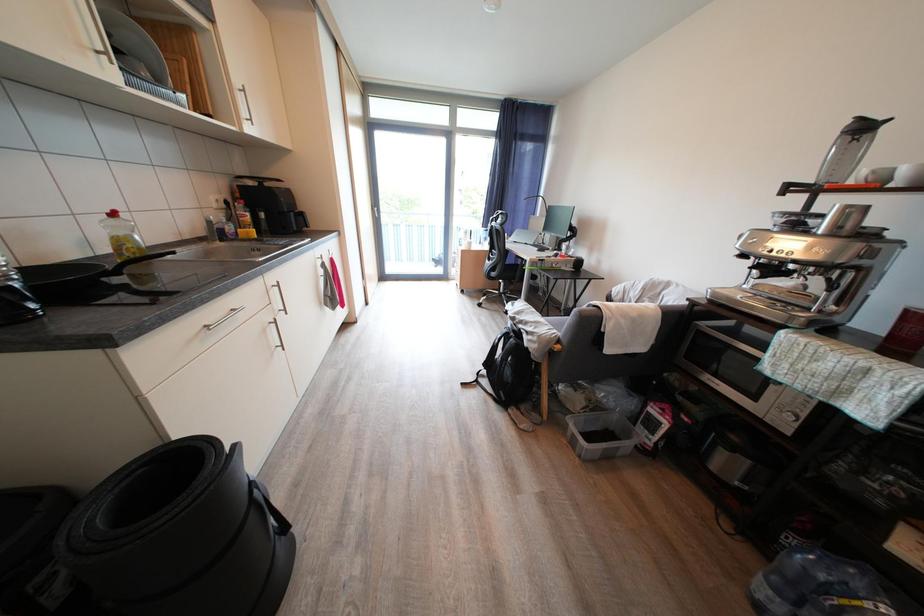
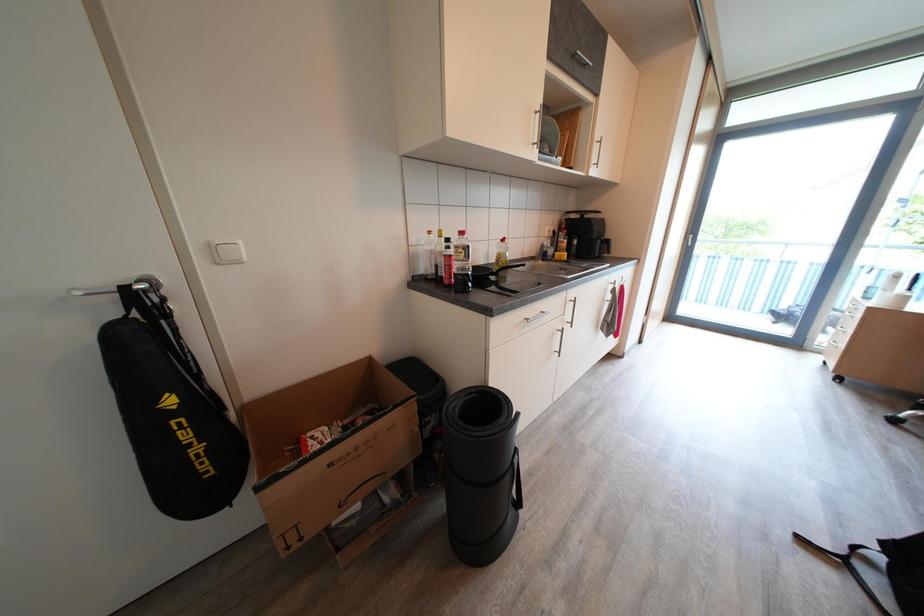
Question: The first image is from the beginning of the video and the second image is from the end. How did the camera likely rotate when shooting the video?

Choices:
 (A) Left
 (B) Right
 (C) Up
 (D) Down

Answer: (A)